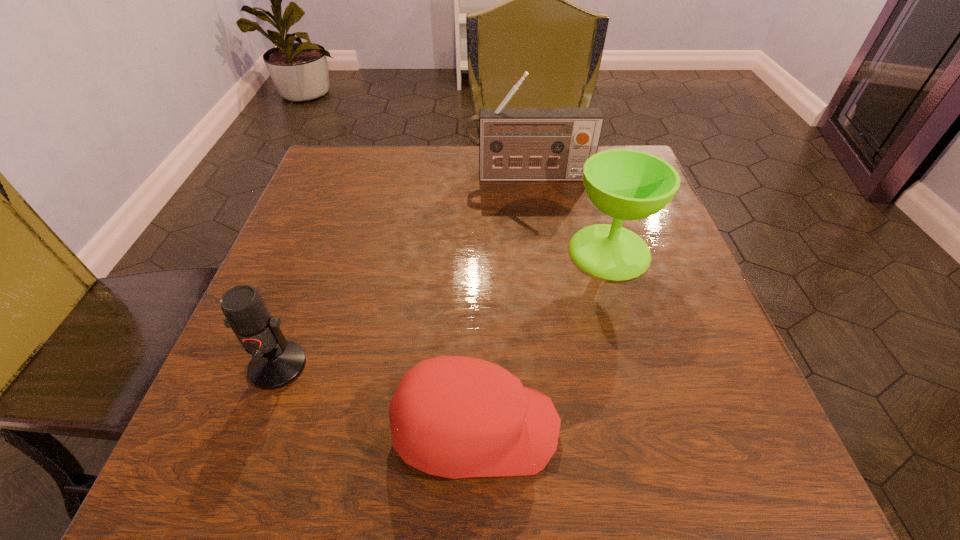
Locate an element on the screen. free spot between the leftmost object and the farthest object is located at coordinates (403, 271).

Identify the location of empty space between the cap and the wineglass. (542, 340).

Where is `free space that is in between the leftmost object and the wineglass`? This screenshot has height=540, width=960. free space that is in between the leftmost object and the wineglass is located at coordinates (444, 308).

The height and width of the screenshot is (540, 960). I want to click on free area in between the shortest object and the farthest object, so click(502, 303).

In order to click on free point between the tallest object and the microphone in this screenshot , I will do pyautogui.click(x=403, y=271).

This screenshot has height=540, width=960. What are the coordinates of `vacant area between the microphone and the tallest object` in the screenshot? It's located at (403, 271).

Identify the location of free space between the shortest object and the leftmost object. This screenshot has width=960, height=540. (377, 397).

Image resolution: width=960 pixels, height=540 pixels. Identify the location of vacant area that lies between the cap and the wineglass. (542, 340).

Where is `vacant space that is in between the microphone and the second farthest object`? This screenshot has width=960, height=540. vacant space that is in between the microphone and the second farthest object is located at coordinates (444, 308).

Where is `object that stands as the second closest to the radio receiver`? This screenshot has height=540, width=960. object that stands as the second closest to the radio receiver is located at coordinates (276, 362).